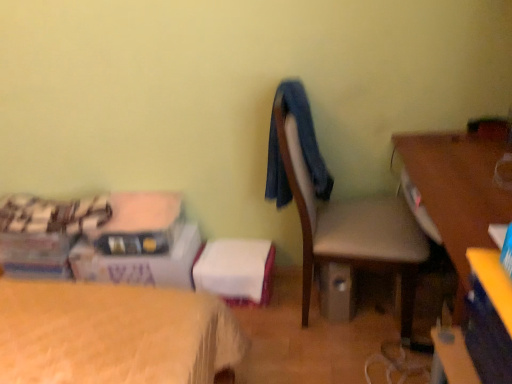
Question: Are white cardboard box at lower left and matte gray chair at center making contact?

Choices:
 (A) no
 (B) yes

Answer: (A)

Question: Does white cardboard box at lower left have a larger size compared to matte gray chair at center?

Choices:
 (A) no
 (B) yes

Answer: (A)

Question: Is white cardboard box at lower left to the left of matte gray chair at center from the viewer's perspective?

Choices:
 (A) no
 (B) yes

Answer: (B)

Question: Does white cardboard box at lower left come in front of matte gray chair at center?

Choices:
 (A) yes
 (B) no

Answer: (B)

Question: Is white cardboard box at lower left shorter than matte gray chair at center?

Choices:
 (A) yes
 (B) no

Answer: (A)

Question: Is white cardboard box at lower left thinner than matte gray chair at center?

Choices:
 (A) yes
 (B) no

Answer: (A)

Question: Is matte gray chair at center not close to wooden desk at right?

Choices:
 (A) no
 (B) yes

Answer: (A)

Question: Can you confirm if matte gray chair at center is thinner than wooden desk at right?

Choices:
 (A) yes
 (B) no

Answer: (A)

Question: Considering the relative sizes of matte gray chair at center and wooden desk at right in the image provided, is matte gray chair at center shorter than wooden desk at right?

Choices:
 (A) no
 (B) yes

Answer: (A)

Question: Is wooden desk at right completely or partially inside matte gray chair at center?

Choices:
 (A) yes
 (B) no

Answer: (B)

Question: Considering the relative positions of matte gray chair at center and wooden desk at right in the image provided, is matte gray chair at center to the right of wooden desk at right from the viewer's perspective?

Choices:
 (A) yes
 (B) no

Answer: (B)

Question: Does matte gray chair at center lie behind wooden desk at right?

Choices:
 (A) no
 (B) yes

Answer: (B)

Question: Considering the relative sizes of blue fabric at center and wooden desk at right in the image provided, is blue fabric at center thinner than wooden desk at right?

Choices:
 (A) yes
 (B) no

Answer: (A)